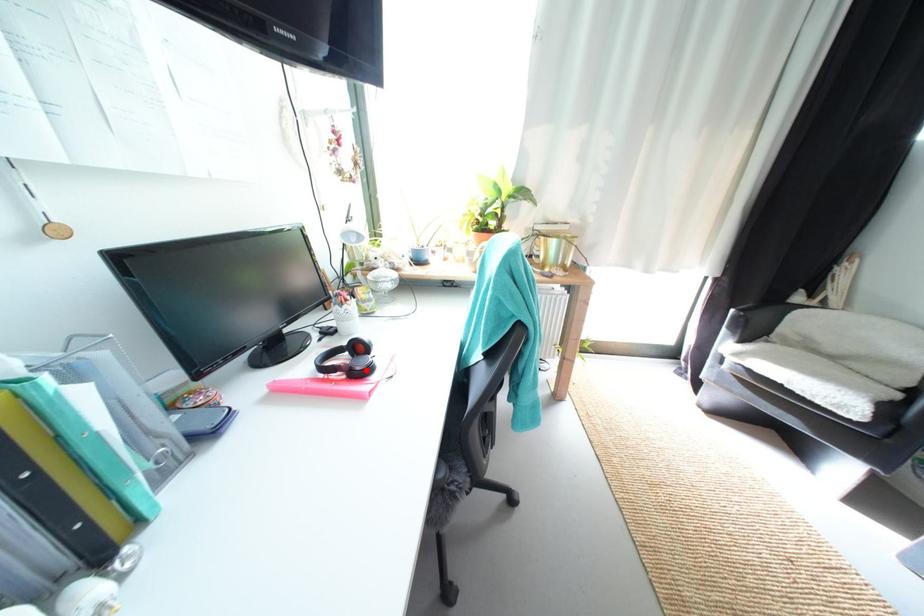
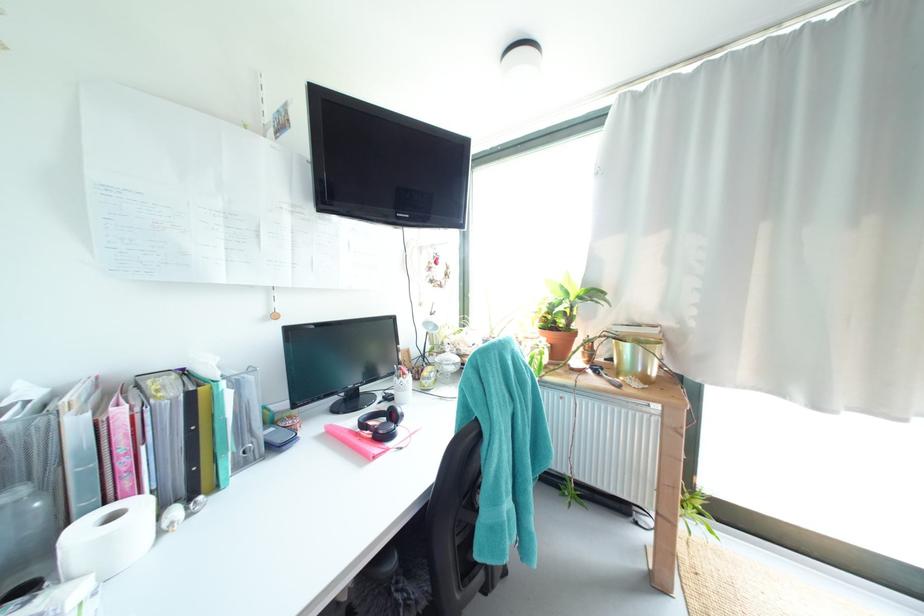
Find the pixel in the second image that matches the highlighted location in the first image.

(388, 434)